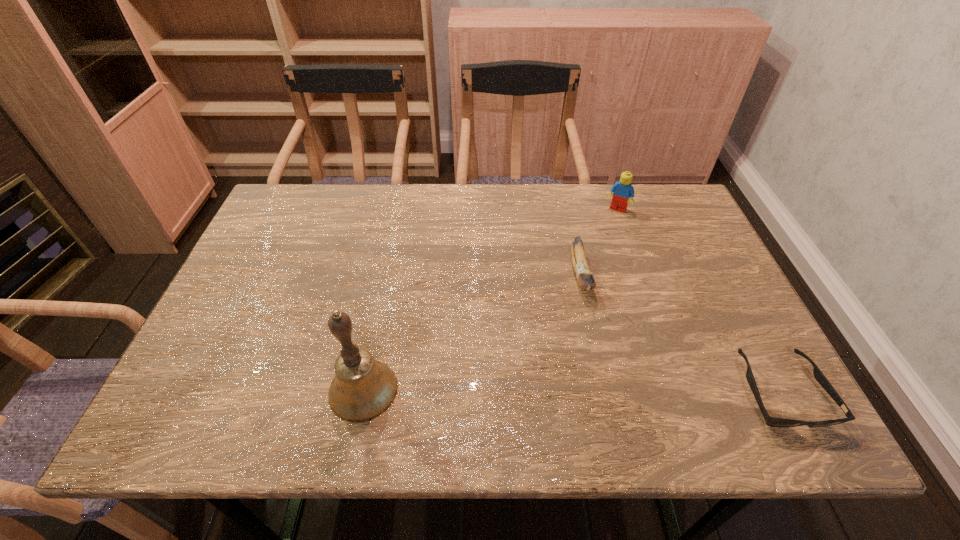
Locate an element on the screen. The width and height of the screenshot is (960, 540). empty location between the farthest object and the third object from right to left is located at coordinates (599, 242).

Where is `free space between the third shortest object and the bell`? Image resolution: width=960 pixels, height=540 pixels. free space between the third shortest object and the bell is located at coordinates (490, 300).

At what (x,y) coordinates should I click in order to perform the action: click on free spot between the third object from left to right and the bell. Please return your answer as a coordinate pair (x, y). The image size is (960, 540). Looking at the image, I should click on (490, 300).

Identify the location of vacant space that is in between the bell and the banana. The image size is (960, 540). (472, 333).

Locate an element on the screen. The height and width of the screenshot is (540, 960). vacant area that lies between the second object from left to right and the Lego is located at coordinates (599, 242).

At what (x,y) coordinates should I click in order to perform the action: click on free spot between the shortest object and the leftmost object. Please return your answer as a coordinate pair (x, y). Looking at the image, I should click on [571, 392].

This screenshot has width=960, height=540. I want to click on vacant space that is in between the shortest object and the second object from left to right, so click(681, 334).

Point out which object is positioned as the third nearest to the third object from left to right. Please provide its 2D coordinates. Your answer should be formatted as a tuple, i.e. [(x, y)], where the tuple contains the x and y coordinates of a point satisfying the conditions above.

[(363, 388)]

Find the location of `object identified as the closest to the tallest object`. object identified as the closest to the tallest object is located at coordinates (585, 278).

Find the location of a particular element. blank space that satisfies the following two spatial constraints: 1. on the back side of the second object from left to right; 2. on the left side of the bell is located at coordinates (387, 275).